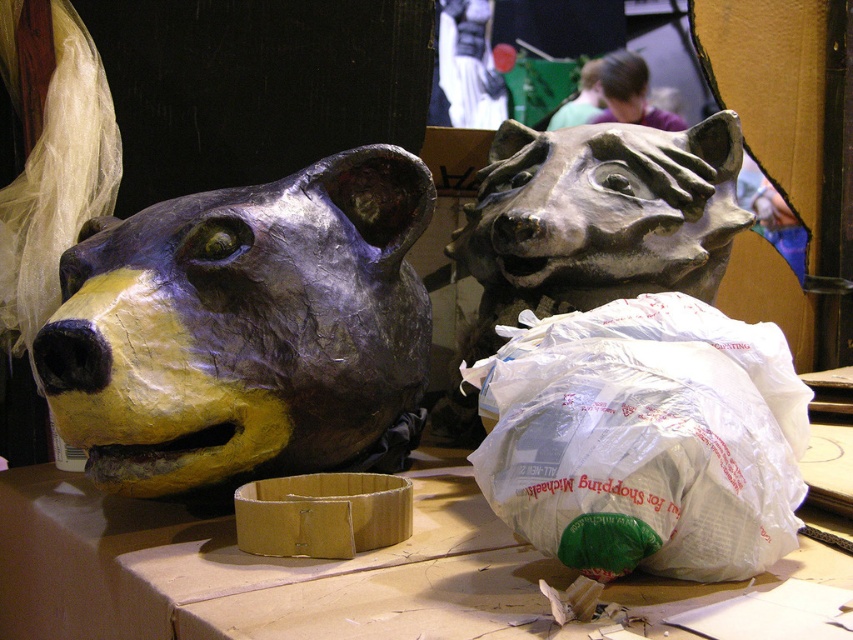
Question: Does matte cardboard table at center come behind matte gray bear head at center?

Choices:
 (A) yes
 (B) no

Answer: (B)

Question: Is white plastic bag at center further to camera compared to matte gray bear head at center?

Choices:
 (A) yes
 (B) no

Answer: (B)

Question: Which point appears closest to the camera in this image?

Choices:
 (A) (309, 410)
 (B) (589, 264)
 (C) (479, 563)

Answer: (C)

Question: Which is nearer to the matte gray bear head at center?

Choices:
 (A) matte cardboard table at center
 (B) white plastic bag at center
 (C) matte papier-mâché bear head at left

Answer: (C)

Question: Can you confirm if white plastic bag at center is positioned to the right of matte cardboard table at center?

Choices:
 (A) yes
 (B) no

Answer: (A)

Question: Which is nearer to the matte cardboard table at center?

Choices:
 (A) matte papier-mâché bear head at left
 (B) white plastic bag at center

Answer: (B)